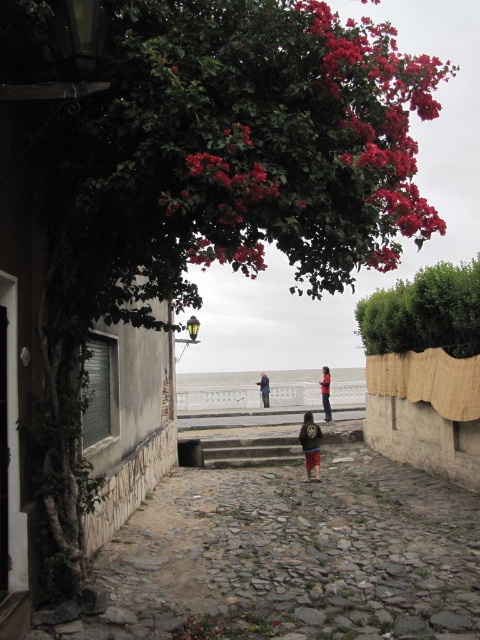
You are a delivery person carrying a package and need to place it on the smooth concrete steps at center. However, there is a dark blue jacket at center in the way. Based on the scene description, can you determine if the jacket is blocking the steps?

The smooth concrete steps at center is below the dark blue jacket at center, so the jacket is blocking the steps.

You are a delivery person carrying a heavy box and need to walk through the alleyway. There are smooth concrete steps at center and a dark blue jacket at center in your path. Can you pass between them without needing to move either object?

The smooth concrete steps at center and dark blue jacket at center are 3.02 meters apart from each other. Since the distance between them is more than enough for a person carrying a box to pass through, you can go between them without moving either object.

You are a delivery person carrying a large package and need to walk through the narrow alleyway. There is a green leafy bush at center and a dark brown leather jacket at center in your path. Which object might block your path more due to its size?

The green leafy bush at center has a larger size compared to the dark brown leather jacket at center, so it would block the path more due to its size.